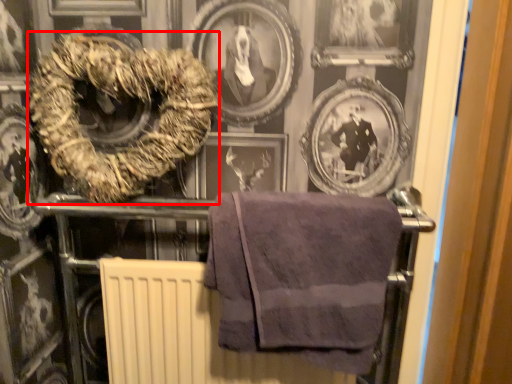
Question: From the image's perspective, what is the correct spatial positioning of towel (annotated by the red box) in reference to towel?

Choices:
 (A) above
 (B) below

Answer: (A)